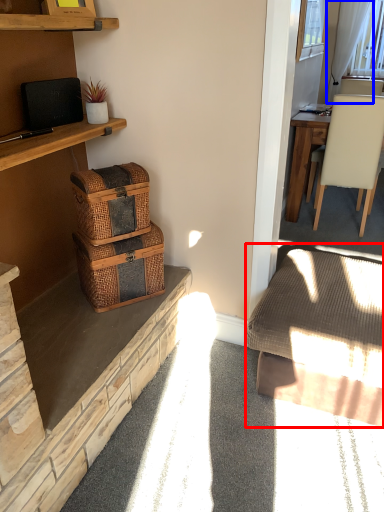
Question: Which object is further to the camera taking this photo, studio couch (highlighted by a red box) or curtain (highlighted by a blue box)?

Choices:
 (A) studio couch
 (B) curtain

Answer: (B)